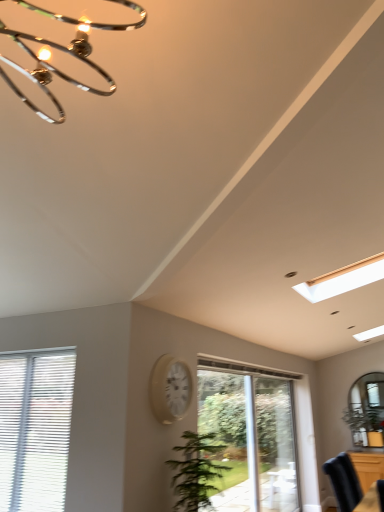
Question: From the image's perspective, is clear glass door at center, acting as the 2th window starting from the left, on clear glass door at center?

Choices:
 (A) yes
 (B) no

Answer: (A)

Question: Can clear glass door at center be found inside clear glass door at center, marked as the 1th window in a right-to-left arrangement?

Choices:
 (A) yes
 (B) no

Answer: (B)

Question: Can you confirm if clear glass door at center, the second window when ordered from front to back, is bigger than clear glass door at center?

Choices:
 (A) no
 (B) yes

Answer: (A)

Question: From a real-world perspective, is clear glass door at center, the first window positioned from the back, under clear glass door at center?

Choices:
 (A) no
 (B) yes

Answer: (A)

Question: Is clear glass door at center, marked as the 1th window in a right-to-left arrangement, thinner than clear glass door at center?

Choices:
 (A) yes
 (B) no

Answer: (B)

Question: Is green leafy plant at center taller or shorter than clear glass door at center, acting as the 2th window starting from the left?

Choices:
 (A) tall
 (B) short

Answer: (B)

Question: From the image's perspective, is green leafy plant at center positioned above or below clear glass door at center, the second window when ordered from front to back?

Choices:
 (A) below
 (B) above

Answer: (B)

Question: Based on their sizes in the image, would you say green leafy plant at center is bigger or smaller than clear glass door at center, acting as the 2th window starting from the left?

Choices:
 (A) big
 (B) small

Answer: (B)

Question: Is green leafy plant at center in front of or behind clear glass door at center, acting as the 2th window starting from the left, in the image?

Choices:
 (A) front
 (B) behind

Answer: (A)

Question: Is clear glass door at center taller or shorter than clear glass door at center, marked as the 1th window in a right-to-left arrangement?

Choices:
 (A) tall
 (B) short

Answer: (A)

Question: Considering the positions of clear glass door at center and clear glass door at center, the second window when ordered from front to back, in the image, is clear glass door at center wider or thinner than clear glass door at center, the second window when ordered from front to back,?

Choices:
 (A) wide
 (B) thin

Answer: (B)

Question: Based on their positions, is clear glass door at center located to the left or right of clear glass door at center, the first window positioned from the back?

Choices:
 (A) left
 (B) right

Answer: (B)

Question: In the image, is clear glass door at center positioned in front of or behind clear glass door at center, marked as the 1th window in a right-to-left arrangement?

Choices:
 (A) front
 (B) behind

Answer: (B)

Question: Is white blinds at lower left, arranged as the 1th window when viewed from the left, spatially inside clear glass door at center, or outside of it?

Choices:
 (A) inside
 (B) outside

Answer: (B)

Question: Visually, is white blinds at lower left, positioned as the second window in right-to-left order, positioned to the left or to the right of clear glass door at center?

Choices:
 (A) right
 (B) left

Answer: (B)